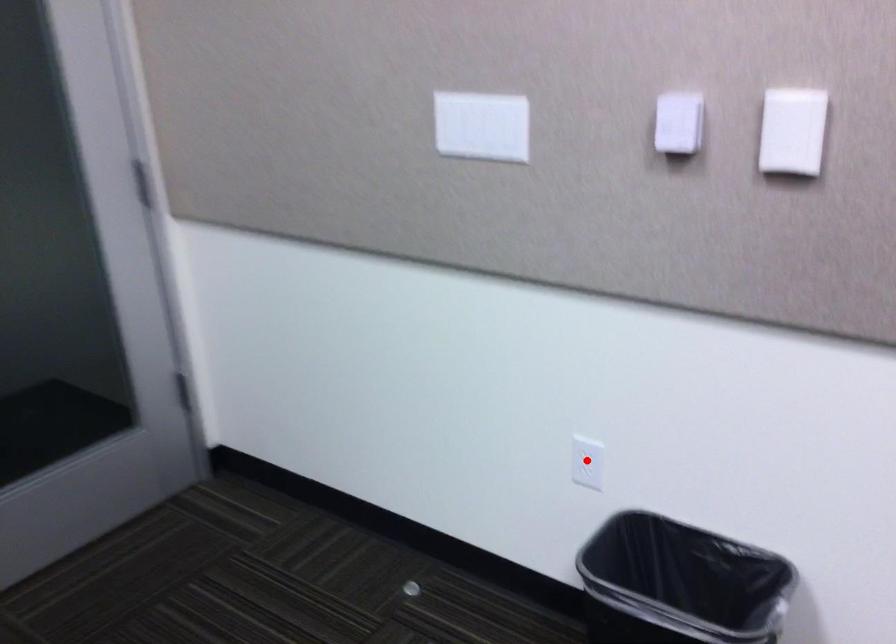
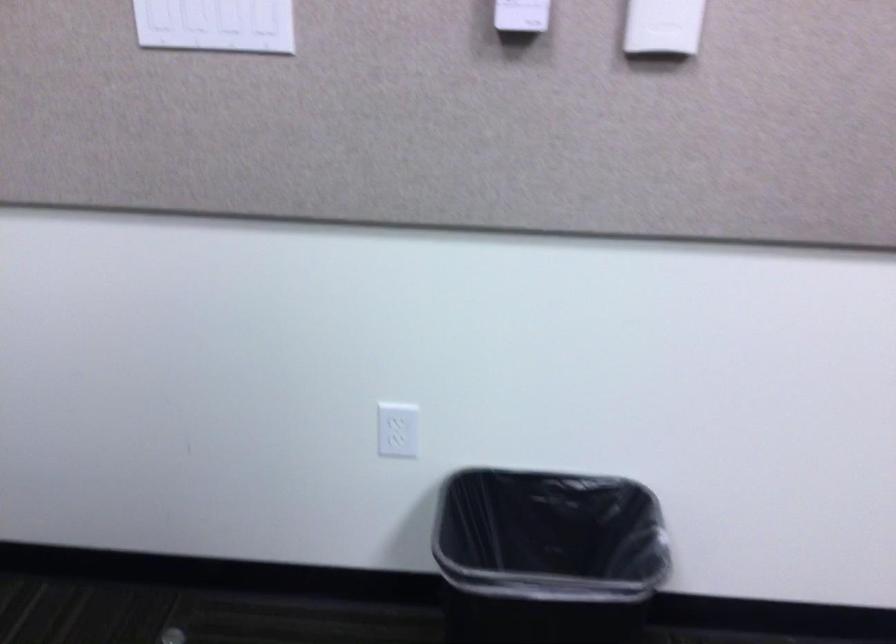
Question: A red point is marked in image1. In image2, is the corresponding 3D point closer to the camera or farther? Reply with the corresponding letter.

Choices:
 (A) The corresponding 3D point is closer.
 (B) The corresponding 3D point is farther.

Answer: (A)